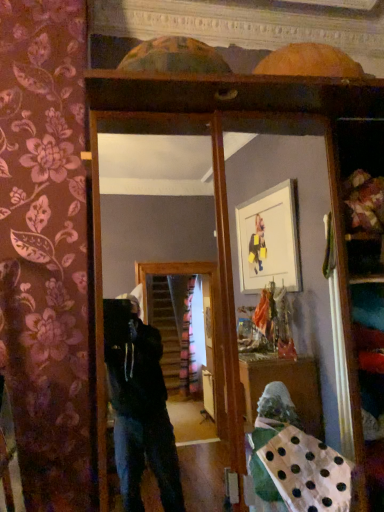
In order to face wooden bookshelf at right, should I rotate leftwards or rightwards?

Turn right by 22.450 degrees to look at wooden bookshelf at right.

The height and width of the screenshot is (512, 384). In order to click on wooden bookshelf at right in this screenshot , I will do `click(360, 292)`.

What do you see at coordinates (360, 292) in the screenshot?
I see `wooden bookshelf at right` at bounding box center [360, 292].

Find the location of a particular element. wooden bookshelf at right is located at coordinates (360, 292).